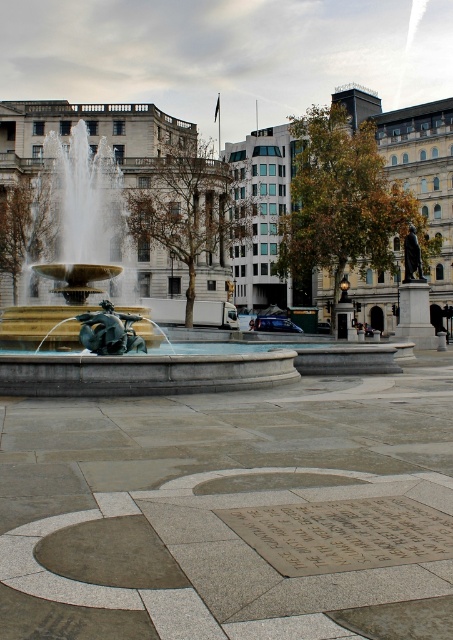
You are planning to place a new bench in the public square. The bench requires a space that is wider than the bronze plaque at center. Can the area near the gold polished stone fountain at center accommodate the bench?

The gold polished stone fountain at center is wider than the bronze plaque at center, so the area near it can accommodate the bench as it meets the width requirement.

You are standing in the public square and want to locate the gold polished stone fountain at center. According to the coordinates provided, where would you find it?

The gold polished stone fountain at center is located at coordinates point (97,307).